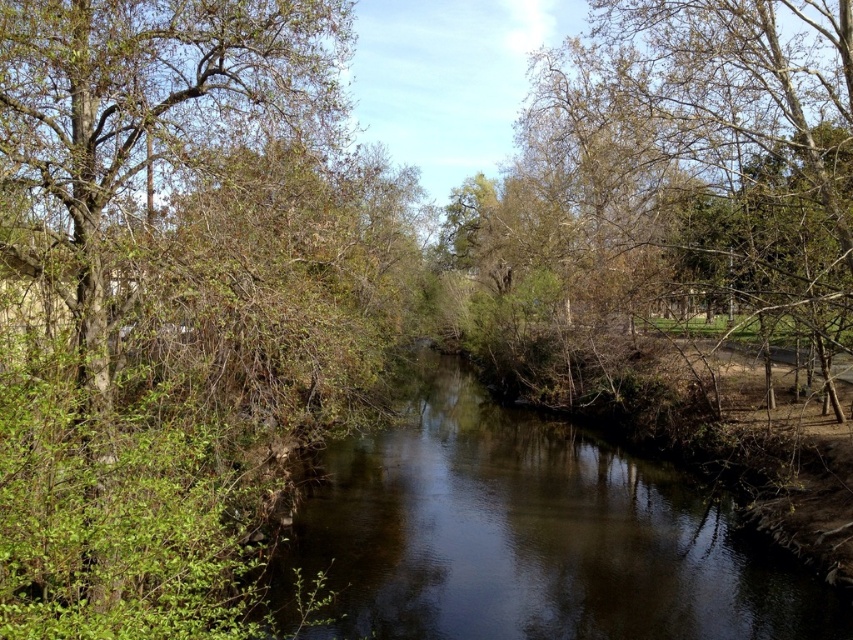
Question: Can you confirm if dark brown water at center is positioned to the left of bare branches at center?

Choices:
 (A) no
 (B) yes

Answer: (B)

Question: Which of the following is the closest to the observer?

Choices:
 (A) (238, 444)
 (B) (550, 77)
 (C) (393, 584)

Answer: (A)

Question: Among these points, which one is farthest from the camera?

Choices:
 (A) (572, 483)
 (B) (213, 284)

Answer: (A)

Question: Can you confirm if green leafy tree at left is positioned to the left of bare branches at center?

Choices:
 (A) yes
 (B) no

Answer: (A)

Question: Is dark brown water at center thinner than bare branches at center?

Choices:
 (A) yes
 (B) no

Answer: (B)

Question: Among these objects, which one is nearest to the camera?

Choices:
 (A) bare branches at center
 (B) green leafy tree at left

Answer: (B)